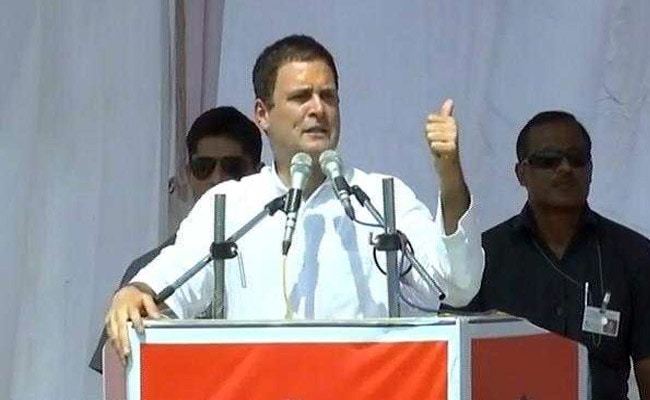
You are a GUI agent. You are given a task and a screenshot of the screen. Output one action in this format:
    pyautogui.click(x=<x>, y=<y>)
    Task: Click on the backdrop
    
    Given the screenshot: What is the action you would take?
    pyautogui.click(x=77, y=110), pyautogui.click(x=436, y=38)